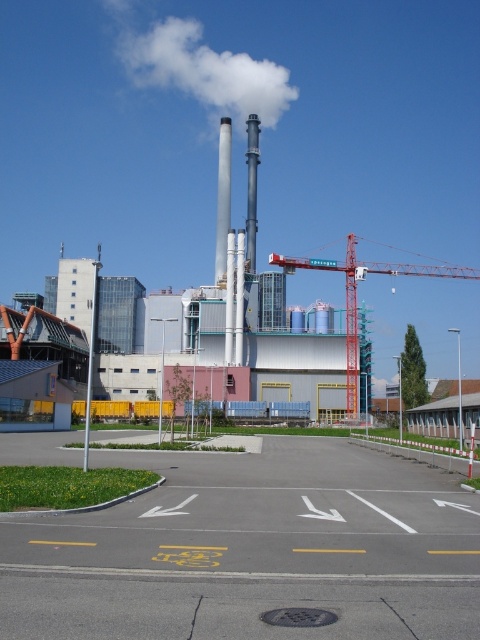
Question: Which point appears farthest from the camera in this image?

Choices:
 (A) (469, 477)
 (B) (69, 477)

Answer: (A)

Question: Which point appears closest to the camera in this image?

Choices:
 (A) (351, 397)
 (B) (226, 140)
 (C) (80, 499)
 (D) (277, 113)

Answer: (C)

Question: Is red metal crane at center bigger than white smooth chimney at center?

Choices:
 (A) no
 (B) yes

Answer: (B)

Question: Which of the following is the farthest from the observer?

Choices:
 (A) (217, 269)
 (B) (468, 477)

Answer: (A)

Question: Observing the image, what is the correct spatial positioning of green grass at lower left in reference to white smooth chimney at center?

Choices:
 (A) right
 (B) left

Answer: (A)

Question: Can you confirm if green grass at lower left is wider than green grass at lower center?

Choices:
 (A) no
 (B) yes

Answer: (A)